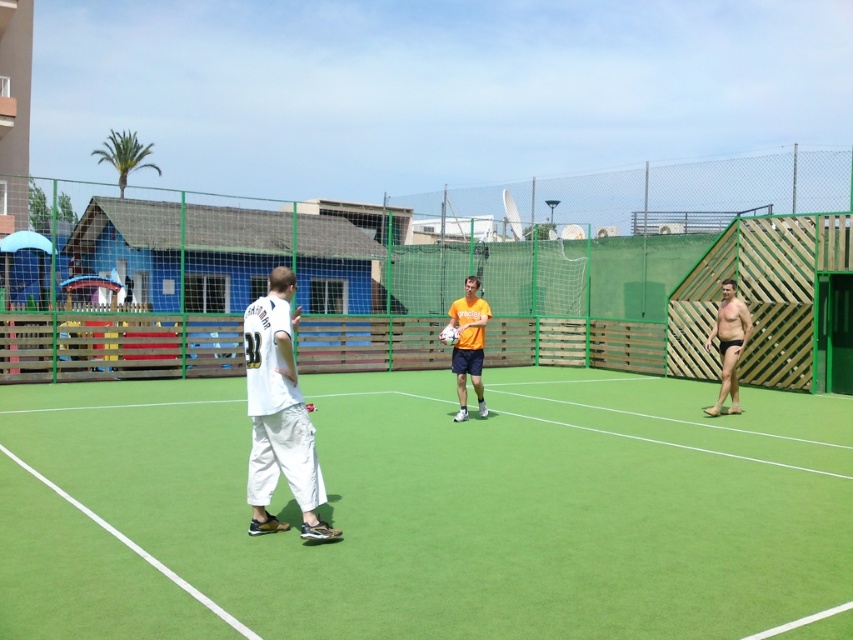
Does white cotton pants at center have a greater height compared to black matte shorts at right?

Correct, white cotton pants at center is much taller as black matte shorts at right.

Does point (270, 419) lie behind point (733, 412)?

No, (270, 419) is closer to viewer.

Find the location of a particular element. white cotton pants at center is located at coordinates (279, 413).

Is point (260, 368) positioned in front of point (457, 372)?

That is True.

Describe the element at coordinates (279, 413) in the screenshot. I see `white cotton pants at center` at that location.

Identify the location of white cotton pants at center. point(279,413).

Who is more forward, (35, 449) or (248, 458)?

Positioned in front is point (248, 458).

Does green artificial turf at center appear over white cotton pants at center?

Incorrect, green artificial turf at center is not positioned above white cotton pants at center.

What do you see at coordinates (427, 509) in the screenshot?
I see `green artificial turf at center` at bounding box center [427, 509].

The width and height of the screenshot is (853, 640). I want to click on green artificial turf at center, so click(427, 509).